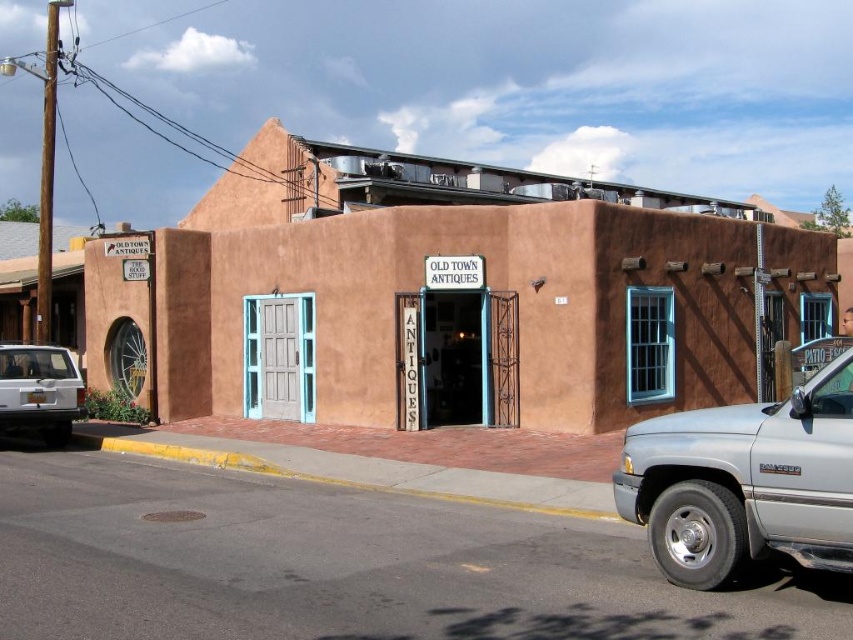
You are standing at the entrance of the building and want to park your car. The silver metallic truck at right and the white matte suv at lower left are already parked. Which vehicle is closer to the entrance?

The white matte suv at lower left is closer to the entrance because it is positioned to the left side, which is nearer to the entrance compared to the silver metallic truck at right that is parked further away on the right side.

You are a delivery person needing to park your 2.5 meter tall van. You see the silver metallic truck at right and the white matte suv at lower left in the parking lot. Which vehicle has enough vertical clearance for your van to pass under?

The white matte suv at lower left is taller than the silver metallic truck at right, so the van can pass under the white matte suv at lower left as it has more vertical clearance.

You are a delivery person arriving at the Old Town Antiques building. You need to park your vehicle but there is limited space. You have a silver metallic truck at right and a white matte suv at lower left in the scene. Which vehicle is blocking the entrance more?

The silver metallic truck at right is blocking the entrance more because it is in front of the white matte suv at lower left, making it harder to access the entrance.